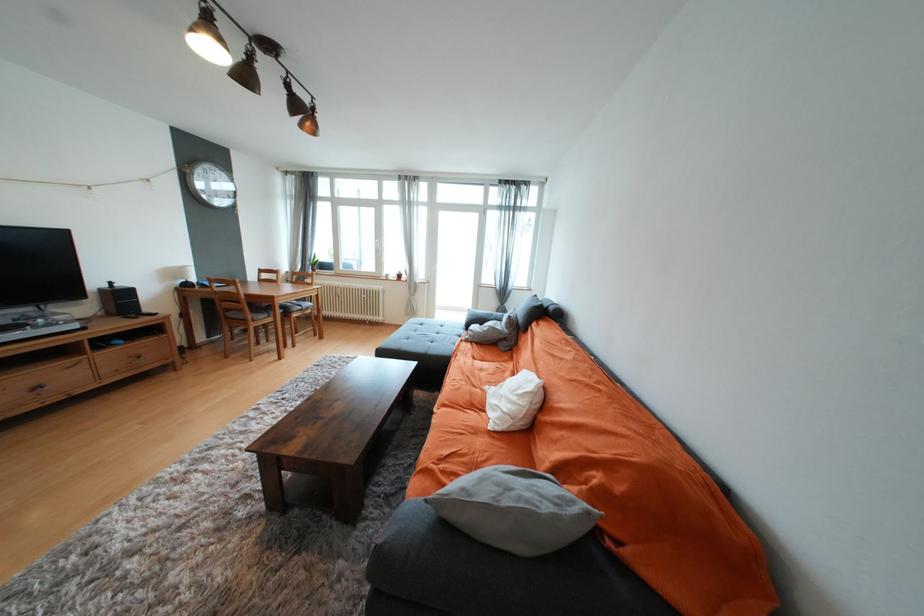
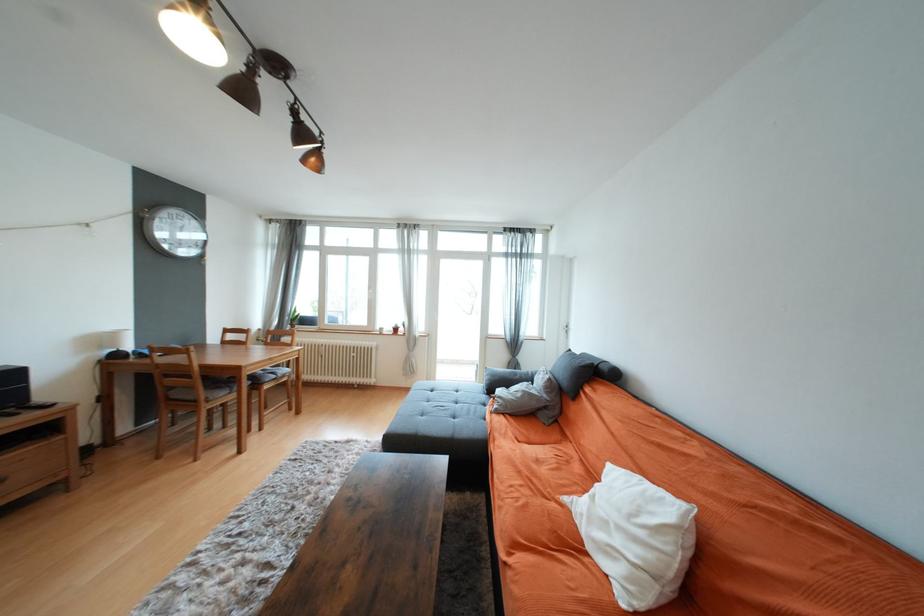
Find the pixel in the second image that matches point 285,302 in the first image.

(253, 374)